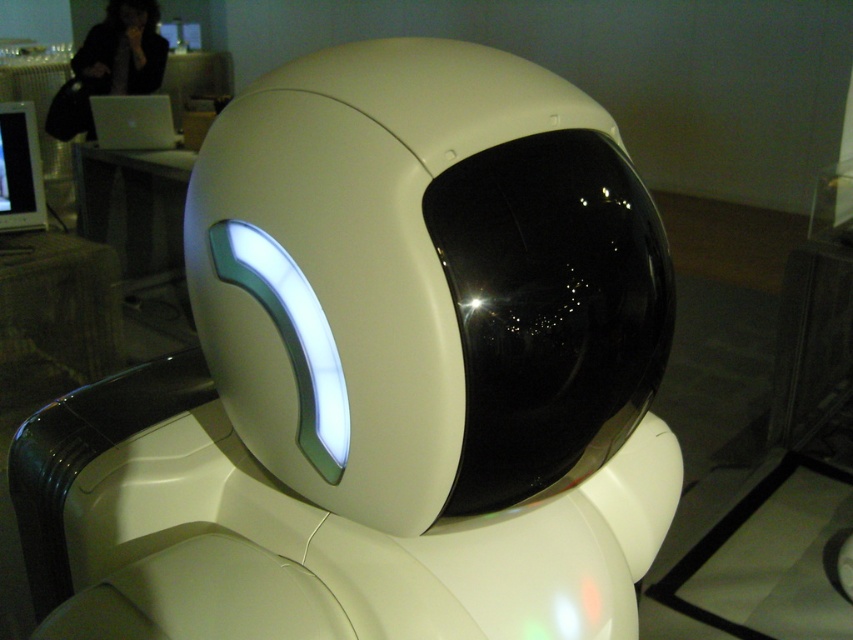
Question: Which object is farther from the camera taking this photo?

Choices:
 (A) white glossy robot head at center
 (B) matte black monitor at left

Answer: (B)

Question: Can you confirm if matte black monitor at left is positioned to the left of silver metallic laptop at upper left?

Choices:
 (A) yes
 (B) no

Answer: (B)

Question: Is white glossy robot head at center below silver metallic laptop at upper left?

Choices:
 (A) yes
 (B) no

Answer: (A)

Question: Which object is positioned closest to the white glossy robot head at center?

Choices:
 (A) silver metallic laptop at upper left
 (B) matte black monitor at left

Answer: (B)

Question: Is white glossy robot head at center smaller than silver metallic laptop at upper left?

Choices:
 (A) no
 (B) yes

Answer: (A)

Question: Which of the following is the farthest from the observer?

Choices:
 (A) white glossy robot head at center
 (B) silver metallic laptop at upper left
 (C) matte black monitor at left

Answer: (B)